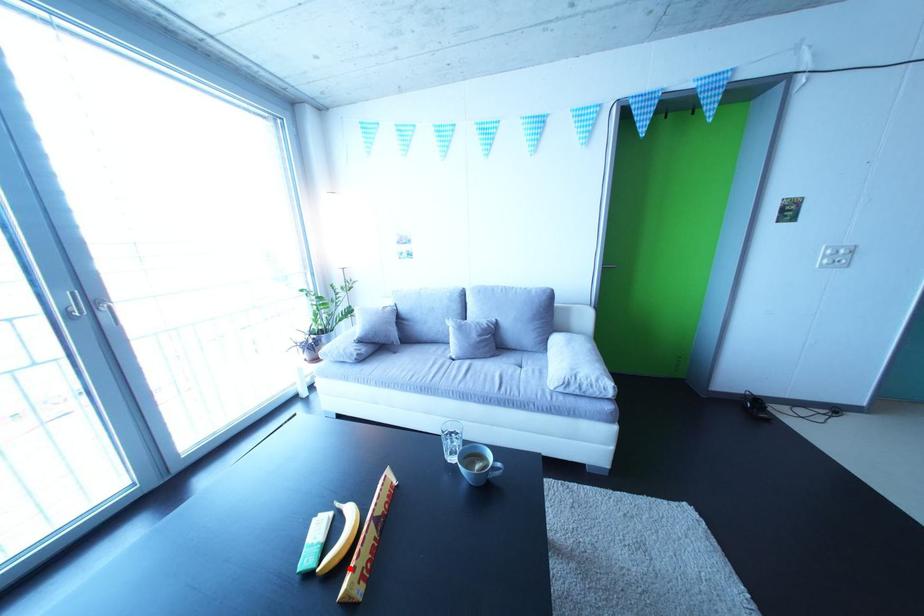
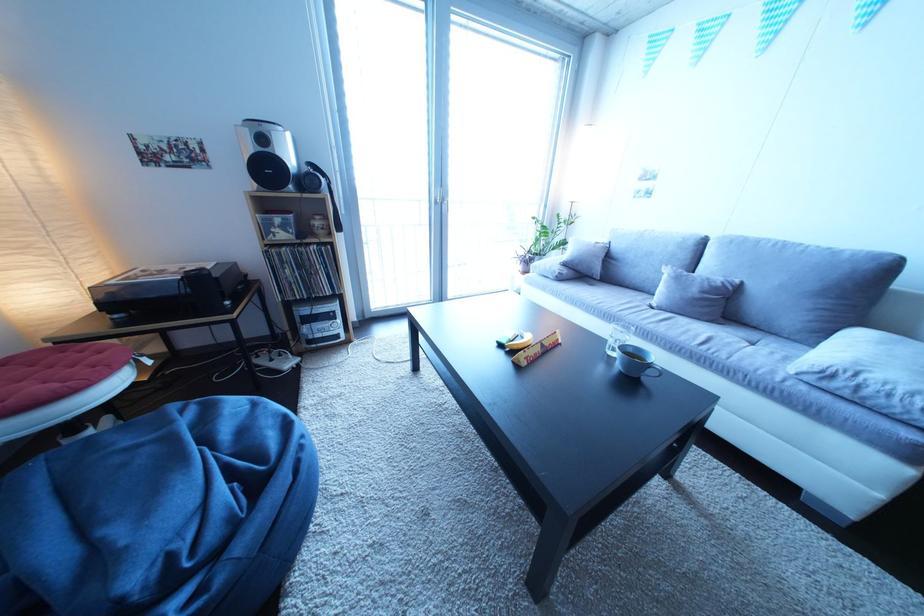
In the second image, find the point that corresponds to the highlighted location in the first image.

(529, 353)